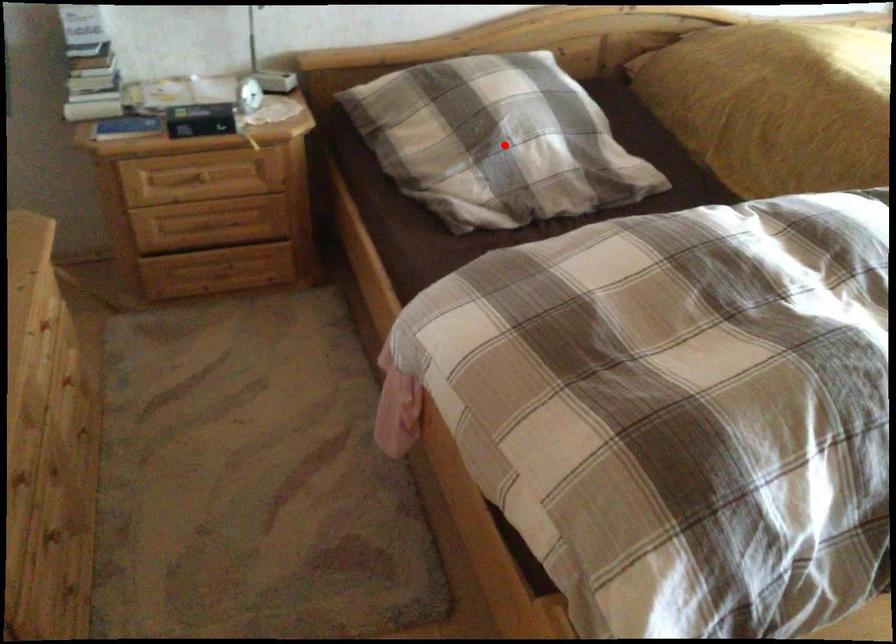
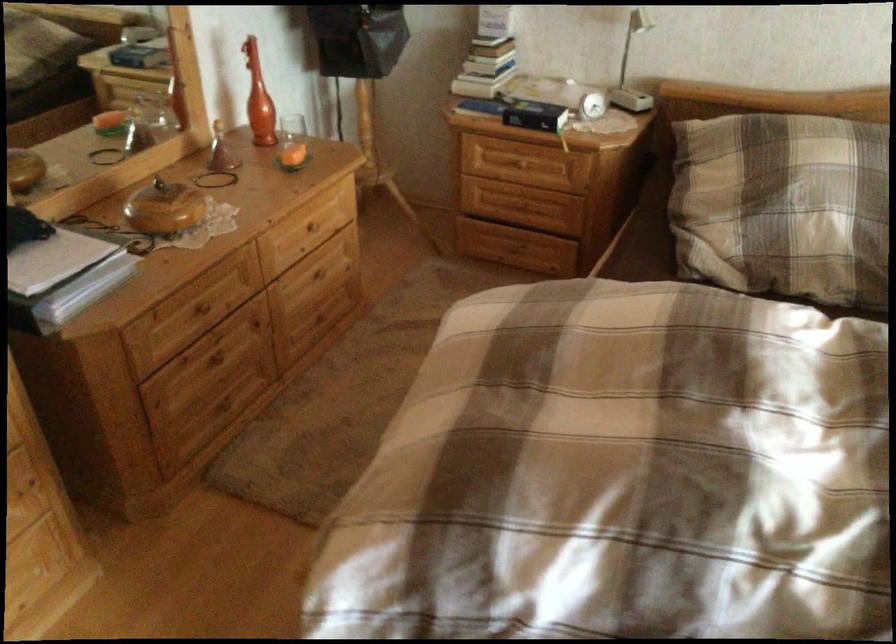
Locate, in the second image, the point that corresponds to the highlighted location in the first image.

(782, 205)